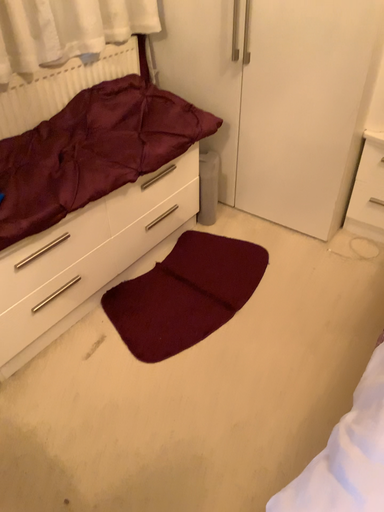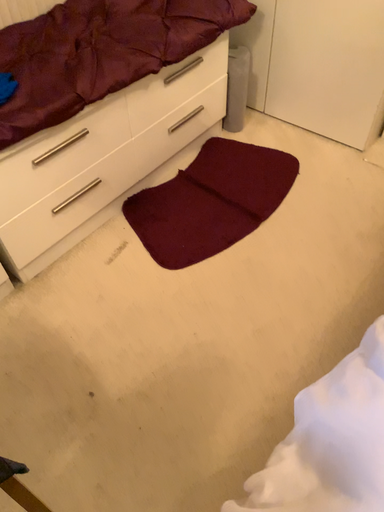
Question: Which way did the camera rotate in the video?

Choices:
 (A) rotated downward
 (B) rotated upward

Answer: (A)